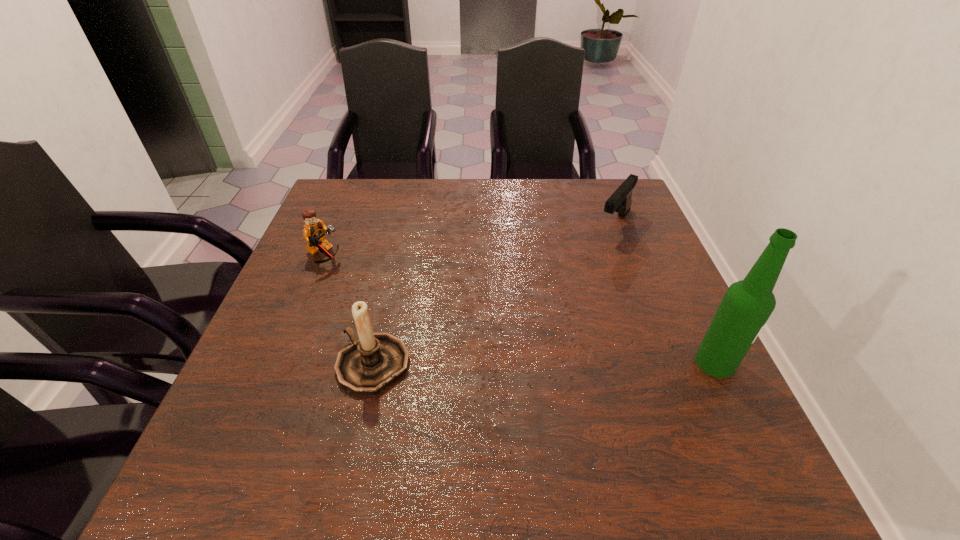
Image resolution: width=960 pixels, height=540 pixels. Identify the location of vacant space located holding a crossbow in the hands of the leftmost object. (396, 291).

Where is `vacant space located 0.370m holding a crossbow in the hands of the leftmost object`? The image size is (960, 540). vacant space located 0.370m holding a crossbow in the hands of the leftmost object is located at coordinates (465, 320).

Where is `object located at the far edge`? The image size is (960, 540). object located at the far edge is located at coordinates (620, 201).

Where is `object that is at the near edge`? object that is at the near edge is located at coordinates (375, 360).

Identify the location of object located at the left edge. The height and width of the screenshot is (540, 960). (314, 231).

Where is `beer bottle positioned at the right edge`? beer bottle positioned at the right edge is located at coordinates (747, 304).

Find the location of a particular element. The height and width of the screenshot is (540, 960). pistol that is at the right edge is located at coordinates (620, 201).

Identify the location of object that is positioned at the far right corner. (620, 201).

The width and height of the screenshot is (960, 540). In order to click on vacant space at the far edge in this screenshot , I will do `click(403, 181)`.

In the image, there is a desktop. In order to click on vacant space at the near edge in this screenshot , I will do `click(449, 407)`.